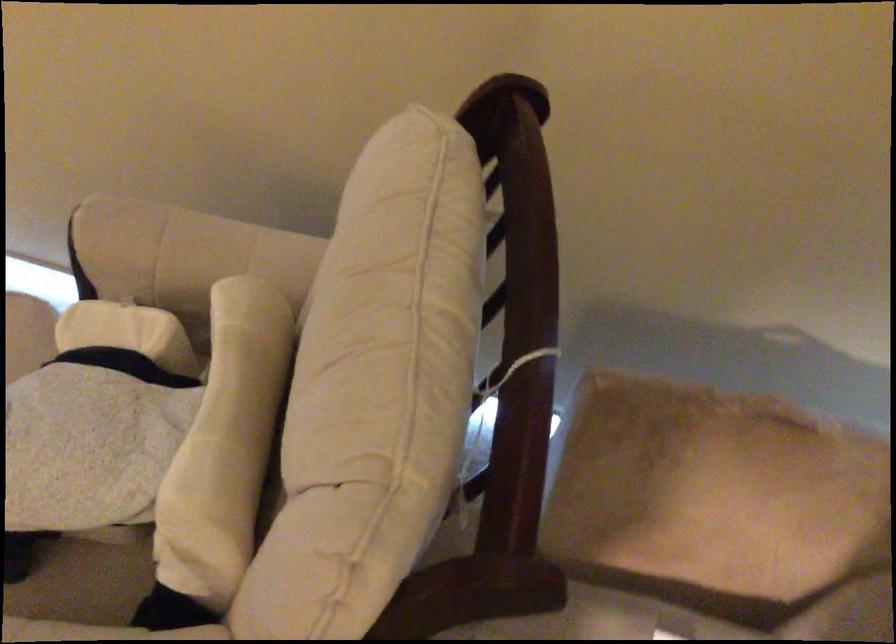
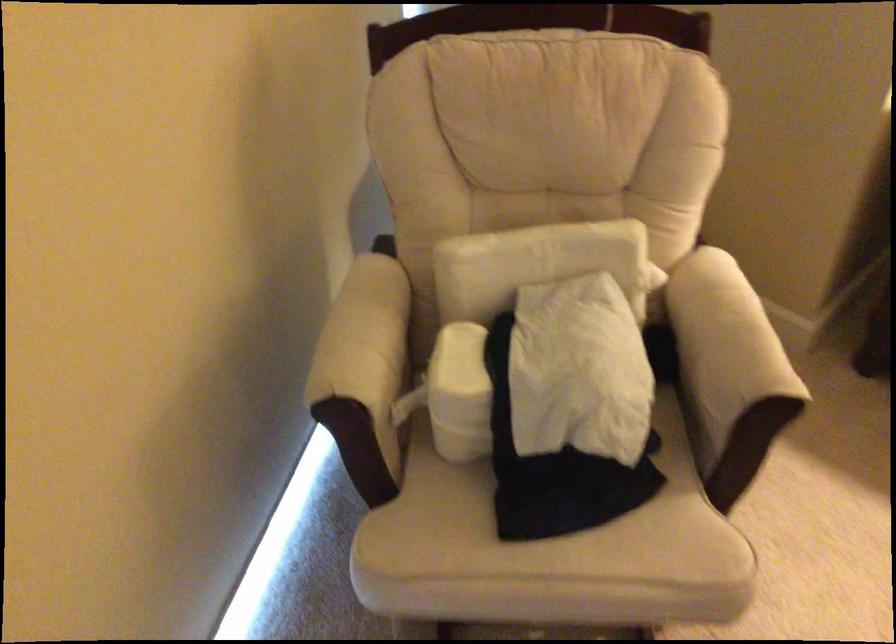
Where in the second image is the point corresponding to point 219,391 from the first image?

(533, 263)